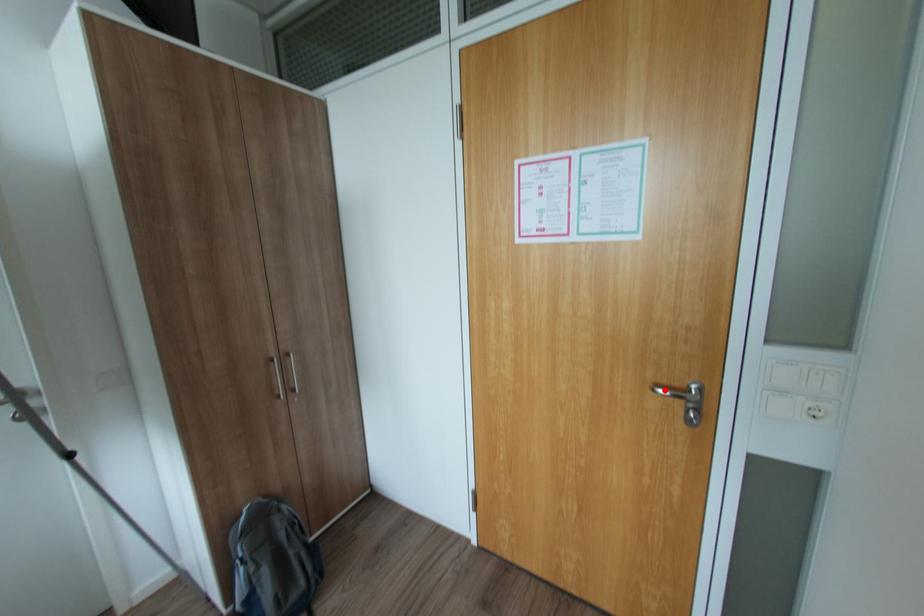
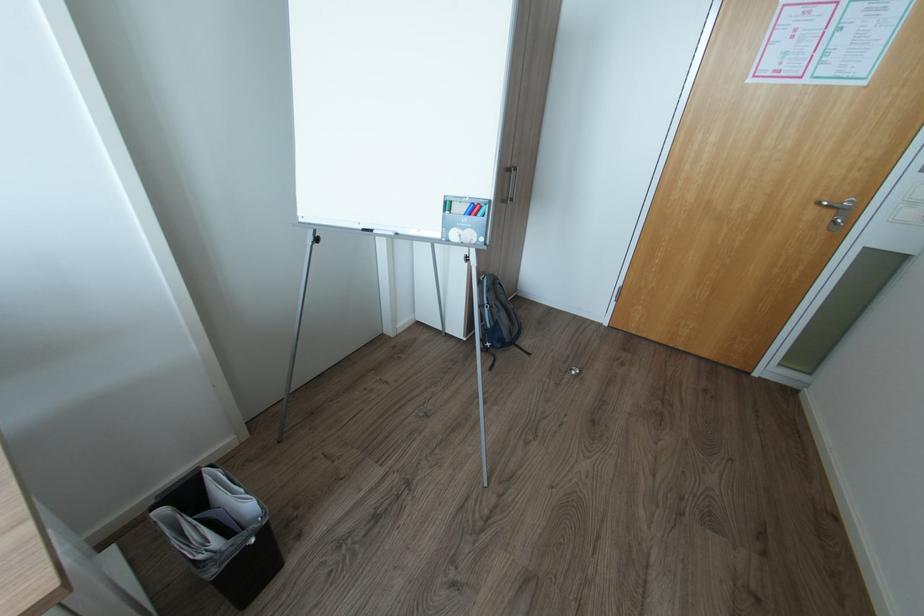
Question: I am providing you with two images of the same scene from different viewpoints. Given a red point in image1, look at the same physical point in image2. Is it:

Choices:
 (A) Closer to the viewpoint
 (B) Farther from the viewpoint

Answer: (B)